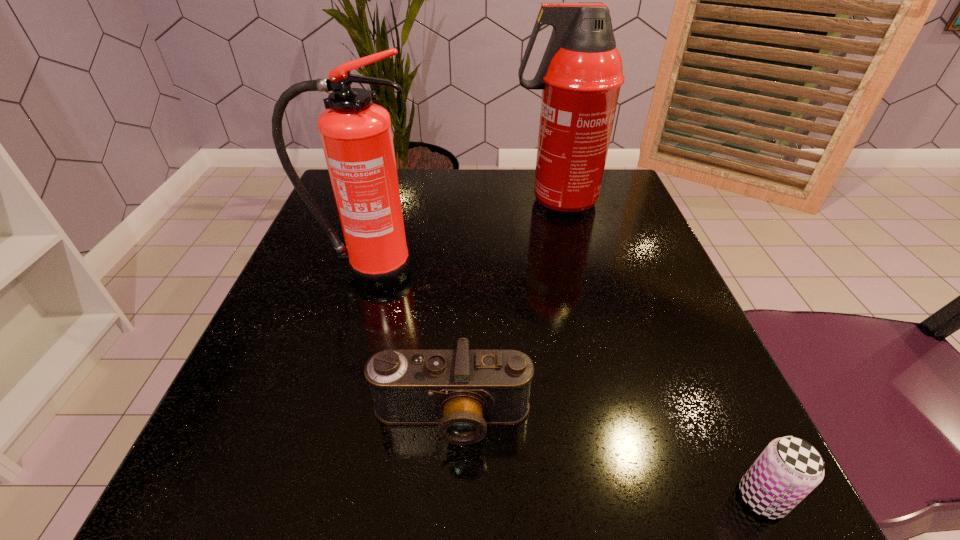
Locate an element on the screen. Image resolution: width=960 pixels, height=540 pixels. free space that satisfies the following two spatial constraints: 1. on the trigger side of the farthest object; 2. at the nozzle of the left fire extinguisher is located at coordinates [573, 271].

Where is `free space that satisfies the following two spatial constraints: 1. on the trigger side of the second object from right to left; 2. at the nozzle of the left fire extinguisher`? This screenshot has width=960, height=540. free space that satisfies the following two spatial constraints: 1. on the trigger side of the second object from right to left; 2. at the nozzle of the left fire extinguisher is located at coordinates (573, 271).

At what (x,y) coordinates should I click in order to perform the action: click on free space that satisfies the following two spatial constraints: 1. on the lens of the beer can; 2. on the left side of the camera. Please return your answer as a coordinate pair (x, y). The height and width of the screenshot is (540, 960). Looking at the image, I should click on (447, 498).

The height and width of the screenshot is (540, 960). Find the location of `blank area in the image that satisfies the following two spatial constraints: 1. on the trigger side of the right fire extinguisher; 2. on the lens of the camera`. blank area in the image that satisfies the following two spatial constraints: 1. on the trigger side of the right fire extinguisher; 2. on the lens of the camera is located at coordinates (609, 417).

The image size is (960, 540). What are the coordinates of `blank space that satisfies the following two spatial constraints: 1. on the trigger side of the right fire extinguisher; 2. on the right side of the nearest object` in the screenshot? It's located at (629, 498).

Identify the location of free location that satisfies the following two spatial constraints: 1. on the trigger side of the second object from right to left; 2. on the left side of the beer can. (629, 498).

This screenshot has width=960, height=540. What are the coordinates of `free point that satisfies the following two spatial constraints: 1. on the trigger side of the farthest object; 2. on the right side of the nearest object` in the screenshot? It's located at (629, 498).

Where is `vacant space that satisfies the following two spatial constraints: 1. on the lens of the beer can; 2. on the right side of the camera`? This screenshot has width=960, height=540. vacant space that satisfies the following two spatial constraints: 1. on the lens of the beer can; 2. on the right side of the camera is located at coordinates (447, 498).

Identify the location of free space that satisfies the following two spatial constraints: 1. on the trigger side of the farther fire extinguisher; 2. on the back side of the rightmost object. (629, 498).